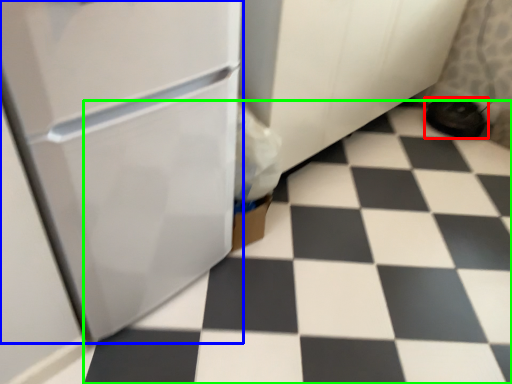
Question: Which object is positioned farthest from footwear (highlighted by a red box)? Select from refrigerator (highlighted by a blue box) and tile (highlighted by a green box).

Choices:
 (A) refrigerator
 (B) tile

Answer: (A)